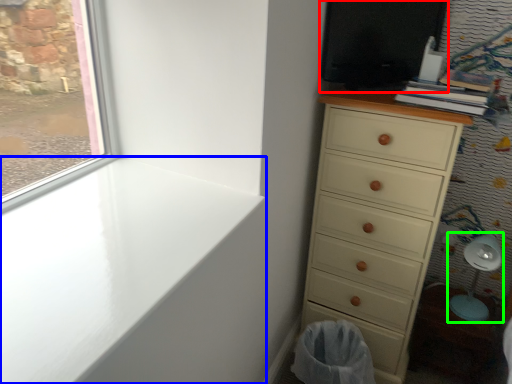
Question: Based on their relative distances, which object is farther from screen door (highlighted by a red box)? Choose from window sill (highlighted by a blue box) and swivel chair (highlighted by a green box).

Choices:
 (A) window sill
 (B) swivel chair

Answer: (B)